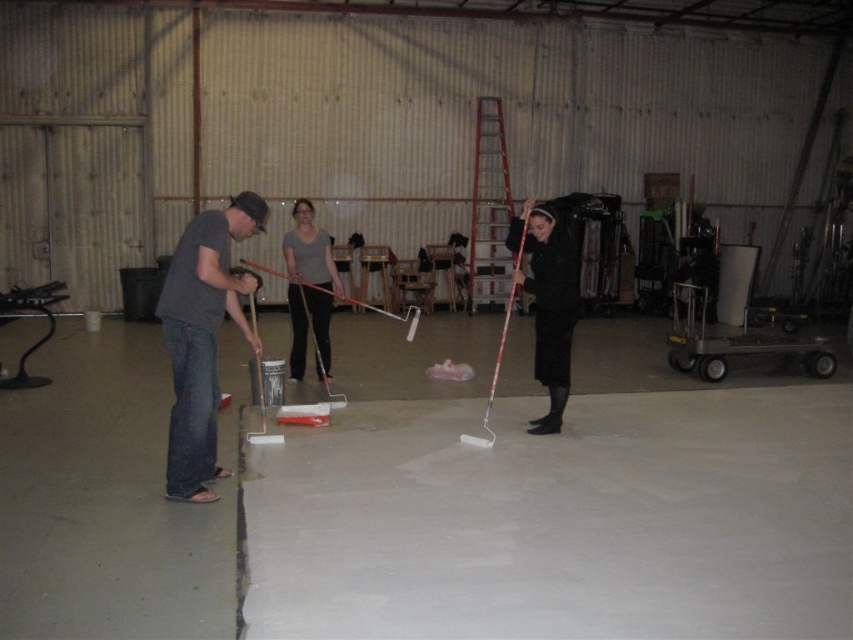
Based on the scene described, which object is smaller in size between the smooth concrete at center and the matte gray shirt at center?

The smooth concrete at center has a smaller size compared to the matte gray shirt at center.